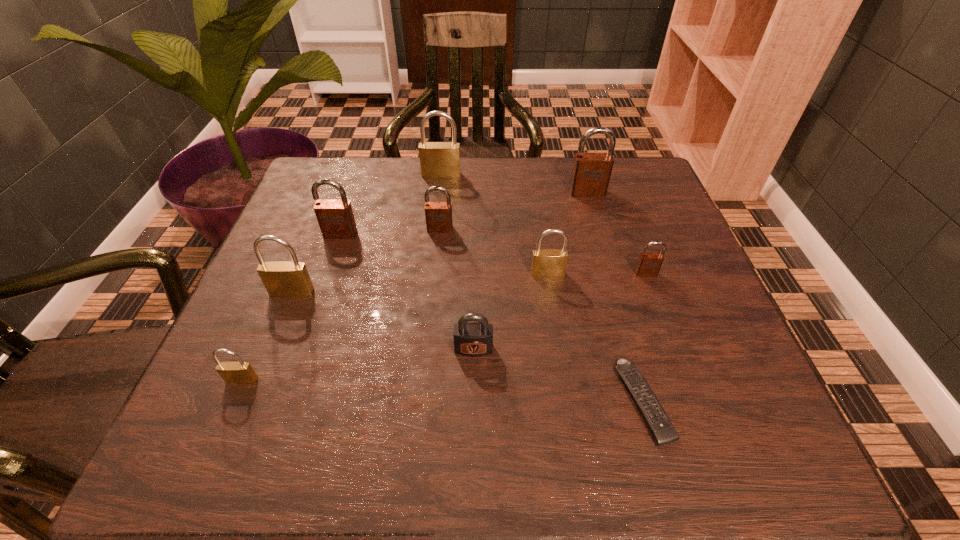
Where is `vacant space that's between the leftmost brown padlock and the shortest object`? Image resolution: width=960 pixels, height=540 pixels. vacant space that's between the leftmost brown padlock and the shortest object is located at coordinates (492, 318).

The image size is (960, 540). I want to click on vacant space in between the shortest object and the rightmost padlock, so click(644, 338).

You are a GUI agent. You are given a task and a screenshot of the screen. Output one action in this format:
    pyautogui.click(x=<x>, y=<y>)
    Task: Click on the vacant area between the smallest brown padlock and the shortest object
    The width and height of the screenshot is (960, 540).
    Given the screenshot: What is the action you would take?
    pyautogui.click(x=644, y=338)

Where is `vacant space that's between the second biggest brass padlock and the rightmost padlock`? This screenshot has width=960, height=540. vacant space that's between the second biggest brass padlock and the rightmost padlock is located at coordinates (468, 283).

Find the location of a particular element. The width and height of the screenshot is (960, 540). vacant region between the smallest brass padlock and the seventh farthest object is located at coordinates tap(267, 336).

Identify the location of empty space that is in between the second farthest padlock and the second smallest brown padlock. (514, 211).

At what (x,y) coordinates should I click in order to perform the action: click on free space between the ninth nearest object and the third smallest brown padlock. Please return your answer as a coordinate pair (x, y). The width and height of the screenshot is (960, 540). Looking at the image, I should click on (464, 213).

Choose which object is the nearest neighbor to the second nearest brass padlock. Please provide its 2D coordinates. Your answer should be formatted as a tuple, i.e. [(x, y)], where the tuple contains the x and y coordinates of a point satisfying the conditions above.

[(336, 220)]

Identify which object is the ninth closest to the smallest brass padlock. Please provide its 2D coordinates. Your answer should be formatted as a tuple, i.e. [(x, y)], where the tuple contains the x and y coordinates of a point satisfying the conditions above.

[(591, 172)]

Identify which padlock is the fourth nearest to the sixth object from left to right. Please provide its 2D coordinates. Your answer should be formatted as a tuple, i.e. [(x, y)], where the tuple contains the x and y coordinates of a point satisfying the conditions above.

[(240, 372)]